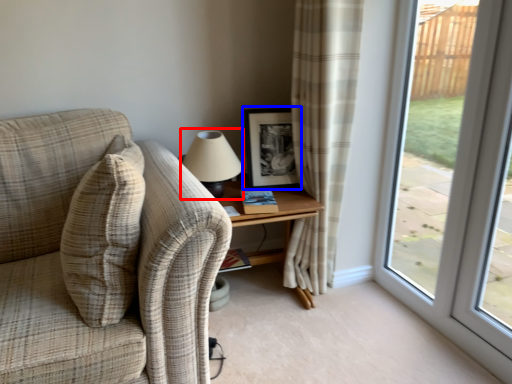
Question: Which object is further to the camera taking this photo, table lamp (highlighted by a red box) or picture frame (highlighted by a blue box)?

Choices:
 (A) table lamp
 (B) picture frame

Answer: (B)